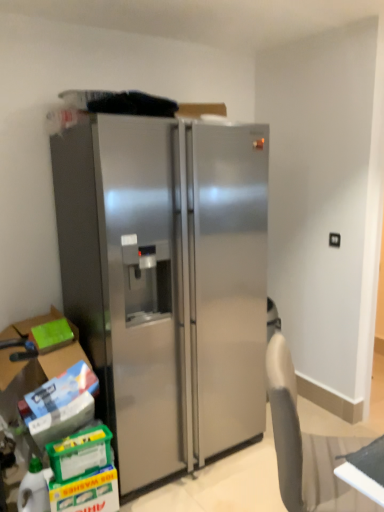
Question: From the image's perspective, is green matte box at lower left on top of stainless steel refrigerator at center?

Choices:
 (A) yes
 (B) no

Answer: (B)

Question: Is green matte box at lower left completely or partially outside of stainless steel refrigerator at center?

Choices:
 (A) no
 (B) yes

Answer: (B)

Question: From the image's perspective, is green matte box at lower left beneath stainless steel refrigerator at center?

Choices:
 (A) yes
 (B) no

Answer: (A)

Question: Is the position of green matte box at lower left more distant than that of stainless steel refrigerator at center?

Choices:
 (A) no
 (B) yes

Answer: (B)

Question: Could you tell me if green matte box at lower left is turned towards stainless steel refrigerator at center?

Choices:
 (A) no
 (B) yes

Answer: (A)

Question: Considering the positions of translucent plastic bottle at lower left and stainless steel refrigerator at center in the image, is translucent plastic bottle at lower left wider or thinner than stainless steel refrigerator at center?

Choices:
 (A) wide
 (B) thin

Answer: (B)

Question: From a real-world perspective, is translucent plastic bottle at lower left positioned above or below stainless steel refrigerator at center?

Choices:
 (A) below
 (B) above

Answer: (A)

Question: In the image, is translucent plastic bottle at lower left positioned in front of or behind stainless steel refrigerator at center?

Choices:
 (A) front
 (B) behind

Answer: (B)

Question: In terms of size, does translucent plastic bottle at lower left appear bigger or smaller than stainless steel refrigerator at center?

Choices:
 (A) big
 (B) small

Answer: (B)

Question: From their relative heights in the image, would you say green matte box at lower left is taller or shorter than translucent plastic bottle at lower left?

Choices:
 (A) tall
 (B) short

Answer: (B)

Question: Does point (39, 359) appear closer or farther from the camera than point (34, 500)?

Choices:
 (A) closer
 (B) farther

Answer: (B)

Question: From the image's perspective, relative to translucent plastic bottle at lower left, is green matte box at lower left above or below?

Choices:
 (A) above
 (B) below

Answer: (A)

Question: Relative to translucent plastic bottle at lower left, is green matte box at lower left in front or behind?

Choices:
 (A) front
 (B) behind

Answer: (B)

Question: In terms of size, does stainless steel refrigerator at center appear bigger or smaller than translucent plastic bottle at lower left?

Choices:
 (A) small
 (B) big

Answer: (B)

Question: From a real-world perspective, is stainless steel refrigerator at center above or below translucent plastic bottle at lower left?

Choices:
 (A) below
 (B) above

Answer: (B)